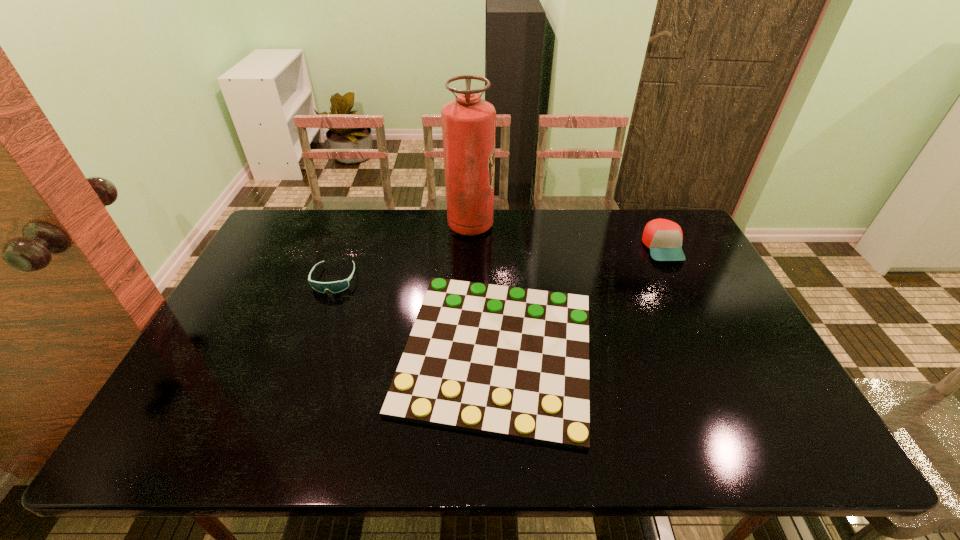
Locate an element on the screen. The width and height of the screenshot is (960, 540). vacant space that satisfies the following two spatial constraints: 1. on the label side of the tallest object; 2. on the front-facing side of the second shortest object is located at coordinates (469, 279).

I want to click on vacant area in the image that satisfies the following two spatial constraints: 1. on the back side of the checkerboard; 2. on the label side of the tallest object, so click(x=492, y=226).

Locate an element on the screen. free space in the image that satisfies the following two spatial constraints: 1. on the front-facing side of the shortest object; 2. on the right side of the leftmost object is located at coordinates (308, 352).

In order to click on free space that satisfies the following two spatial constraints: 1. on the front-facing side of the shortest object; 2. on the left side of the leftmost object in this screenshot , I will do `click(308, 352)`.

What are the coordinates of `free location that satisfies the following two spatial constraints: 1. on the front-facing side of the shortest object; 2. on the left side of the second shortest object` in the screenshot? It's located at tap(308, 352).

At what (x,y) coordinates should I click in order to perform the action: click on vacant region that satisfies the following two spatial constraints: 1. on the label side of the tallest object; 2. on the front-facing side of the goggles. Please return your answer as a coordinate pair (x, y). This screenshot has height=540, width=960. Looking at the image, I should click on (469, 279).